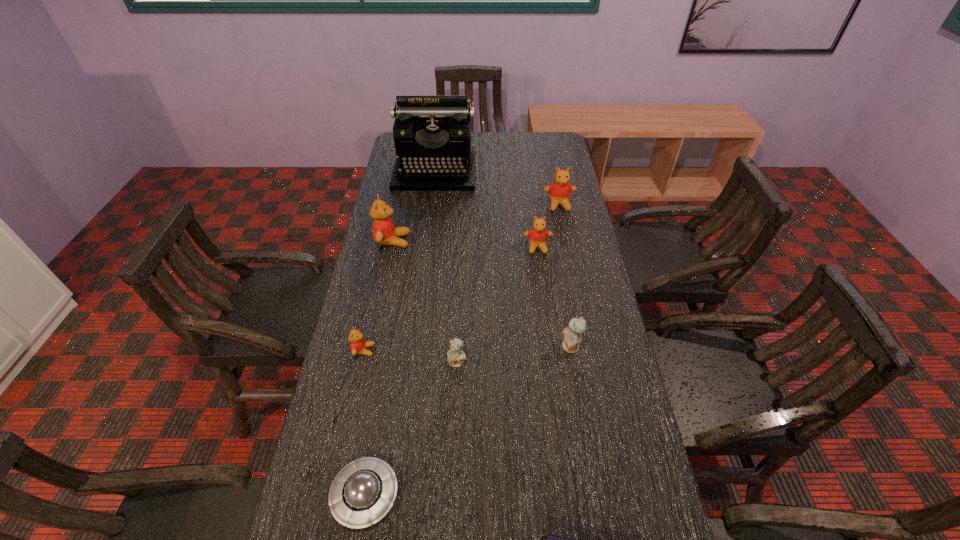
At what (x,y) coordinates should I click in order to perform the action: click on typewriter. Please return your answer as a coordinate pair (x, y). The width and height of the screenshot is (960, 540). Looking at the image, I should click on (432, 134).

The height and width of the screenshot is (540, 960). Find the location of `the tallest object`. the tallest object is located at coordinates (432, 134).

Locate an element on the screen. The height and width of the screenshot is (540, 960). the biggest red teddy bear is located at coordinates (384, 231).

The height and width of the screenshot is (540, 960). Identify the location of the tallest teddy bear. (384, 231).

Find the location of a particular element. the second farthest object is located at coordinates (559, 192).

Find the location of a particular element. the third tallest object is located at coordinates (559, 192).

This screenshot has height=540, width=960. In order to click on the bigger blue teddy bear in this screenshot , I will do `click(572, 335)`.

This screenshot has height=540, width=960. What are the coordinates of `the second smallest red teddy bear` in the screenshot? It's located at (538, 234).

The image size is (960, 540). In order to click on the left blue teddy bear in this screenshot , I will do `click(455, 357)`.

Find the location of a particular element. This screenshot has height=540, width=960. the fourth teddy bear from right to left is located at coordinates pyautogui.click(x=455, y=357).